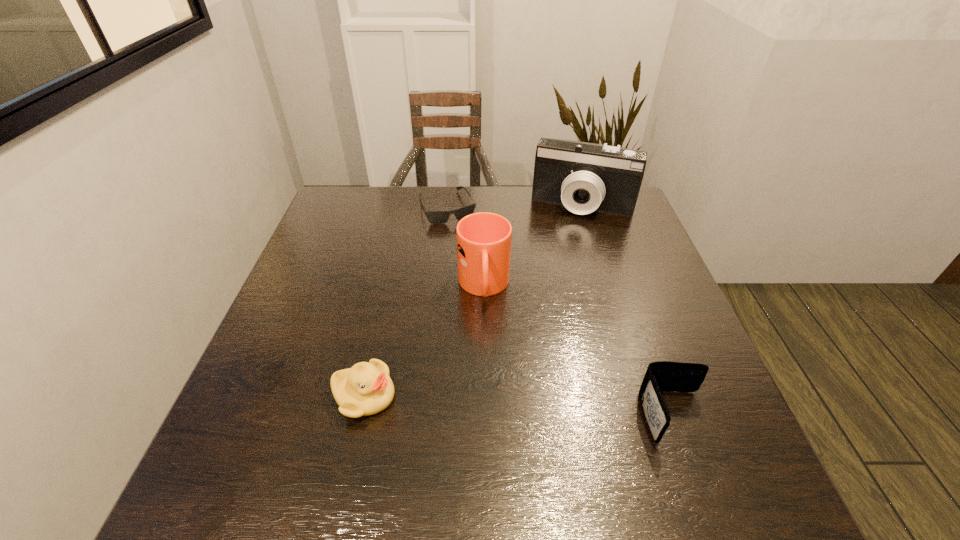
Where is `duckling`? The width and height of the screenshot is (960, 540). duckling is located at coordinates (365, 389).

This screenshot has height=540, width=960. Find the location of `wallet`. wallet is located at coordinates (660, 376).

What are the coordinates of `the shortest object` in the screenshot? It's located at (434, 217).

Find the location of a particular element. camcorder is located at coordinates (584, 177).

You are a GUI agent. You are given a task and a screenshot of the screen. Output one action in this format:
    pyautogui.click(x=<x>, y=<y>)
    Task: Click on the fourth shortest object
    The image size is (960, 540).
    Given the screenshot: What is the action you would take?
    pyautogui.click(x=484, y=239)

Find the location of a particular element. This screenshot has width=960, height=540. the third nearest object is located at coordinates (484, 239).

Locate an element on the screen. blank space located 0.400m at the face of the duckling is located at coordinates [596, 396].

What are the coordinates of `free space located on the front-facing side of the shortest object` in the screenshot? It's located at (497, 320).

I want to click on vacant space situated on the front-facing side of the shortest object, so click(x=486, y=294).

Where is `vacant region located 0.130m on the front-facing side of the shortest object`? The width and height of the screenshot is (960, 540). vacant region located 0.130m on the front-facing side of the shortest object is located at coordinates (467, 251).